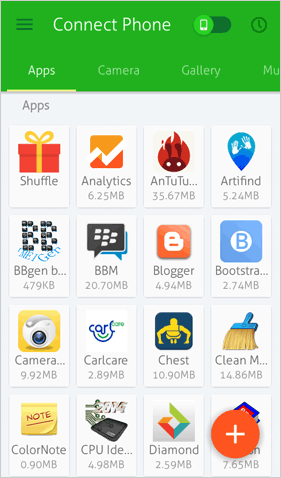
This screenshot has width=281, height=478. I want to click on sweeper, so click(237, 335).